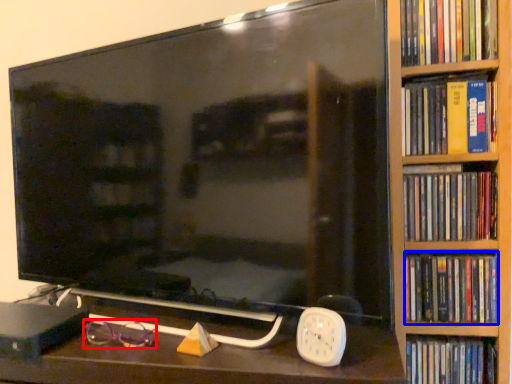
Question: Which object appears farthest to the camera in this image, glasses (highlighted by a red box) or book (highlighted by a blue box)?

Choices:
 (A) glasses
 (B) book

Answer: (B)